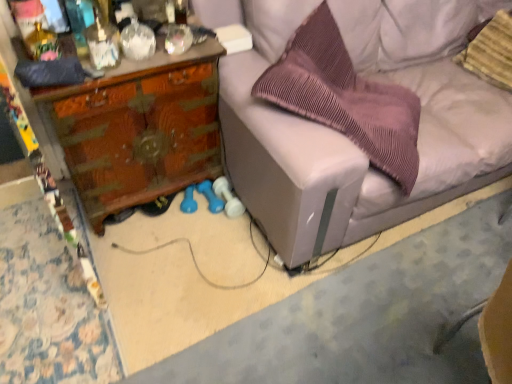
Question: From a real-world perspective, relative to light gray fabric couch at center, is wooden desk at left vertically above or below?

Choices:
 (A) above
 (B) below

Answer: (B)

Question: Based on their sizes in the image, would you say wooden desk at left is bigger or smaller than light gray fabric couch at center?

Choices:
 (A) small
 (B) big

Answer: (A)

Question: Which of these objects is positioned closest to the purple pleated pillow at center, which is the 2th pillow in right-to-left order?

Choices:
 (A) wooden desk at left
 (B) light gray fabric couch at center
 (C) striped fabric pillow at upper right, the 1th pillow when ordered from right to left

Answer: (B)

Question: Considering the real-world distances, which object is closest to the light gray fabric couch at center?

Choices:
 (A) striped fabric pillow at upper right, the 1th pillow when ordered from right to left
 (B) wooden desk at left
 (C) purple pleated pillow at center, placed as the first pillow when sorted from left to right

Answer: (C)